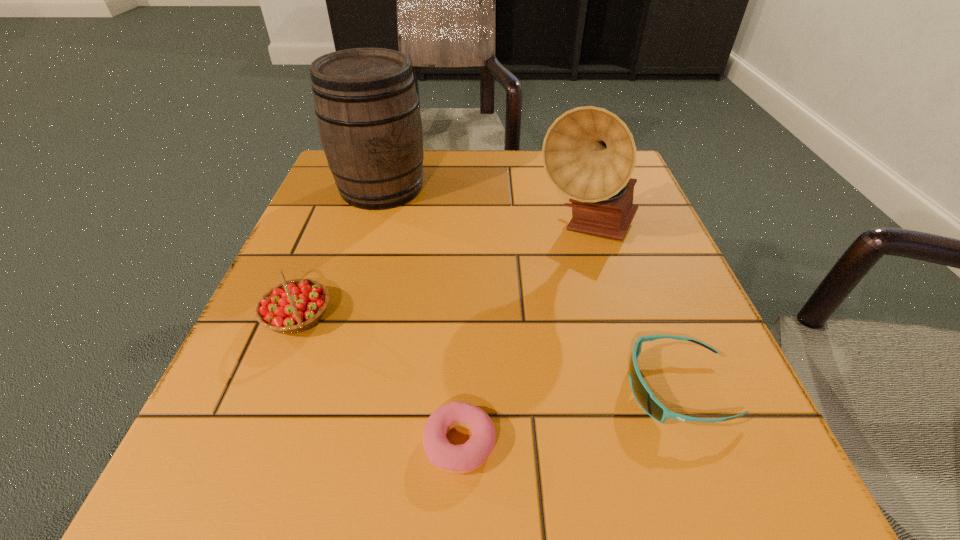
The image size is (960, 540). In order to click on vacant space located on the front-facing side of the fourth tallest object in this screenshot , I will do `click(376, 388)`.

You are a GUI agent. You are given a task and a screenshot of the screen. Output one action in this format:
    pyautogui.click(x=<x>, y=<y>)
    Task: Click on the free space located 0.250m on the front-facing side of the fourth tallest object
    Image resolution: width=960 pixels, height=540 pixels.
    Given the screenshot: What is the action you would take?
    pyautogui.click(x=443, y=388)

At what (x,y) coordinates should I click in order to perform the action: click on vacant space located 0.330m on the front-facing side of the fourth tallest object. Please return your answer as a coordinate pair (x, y). Image resolution: width=960 pixels, height=540 pixels. Looking at the image, I should click on (384, 388).

Identify the location of vacant region located 0.180m on the right of the shortest object. (641, 443).

Locate an element on the screen. This screenshot has height=540, width=960. wine bucket that is at the far edge is located at coordinates (367, 108).

Locate an element on the screen. phonograph record located at the far edge is located at coordinates (589, 154).

Where is `object positioned at the near edge`? The image size is (960, 540). object positioned at the near edge is located at coordinates (457, 459).

Image resolution: width=960 pixels, height=540 pixels. What are the coordinates of `wine bucket that is at the left edge` in the screenshot? It's located at (367, 108).

Where is `strawberry situated at the left edge`? strawberry situated at the left edge is located at coordinates (293, 306).

Where is `phonograph record located in the right edge section of the desktop`? phonograph record located in the right edge section of the desktop is located at coordinates (589, 154).